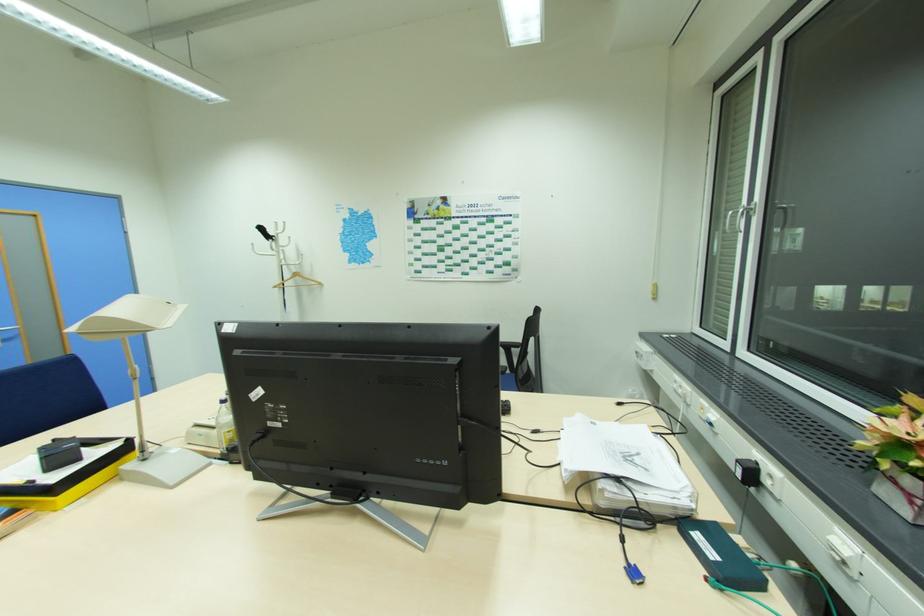
Image resolution: width=924 pixels, height=616 pixels. I want to click on white coat hook, so click(x=276, y=245).